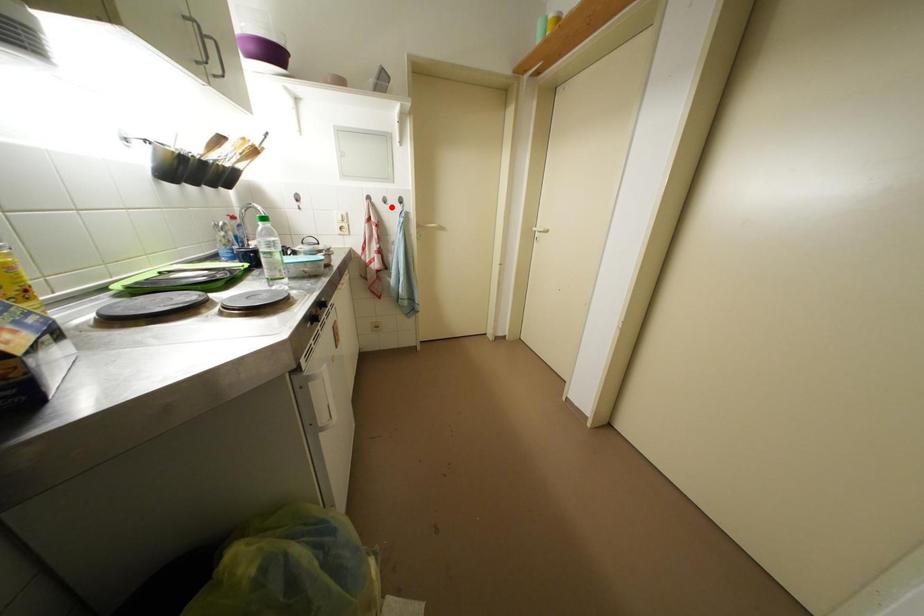
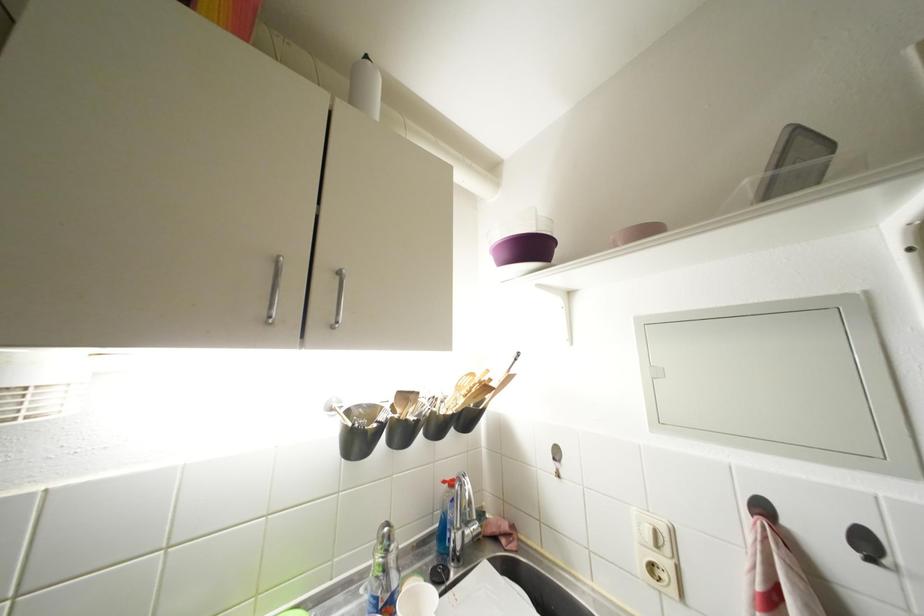
Find the pixel in the second image that matches the highlighted location in the first image.

(877, 565)